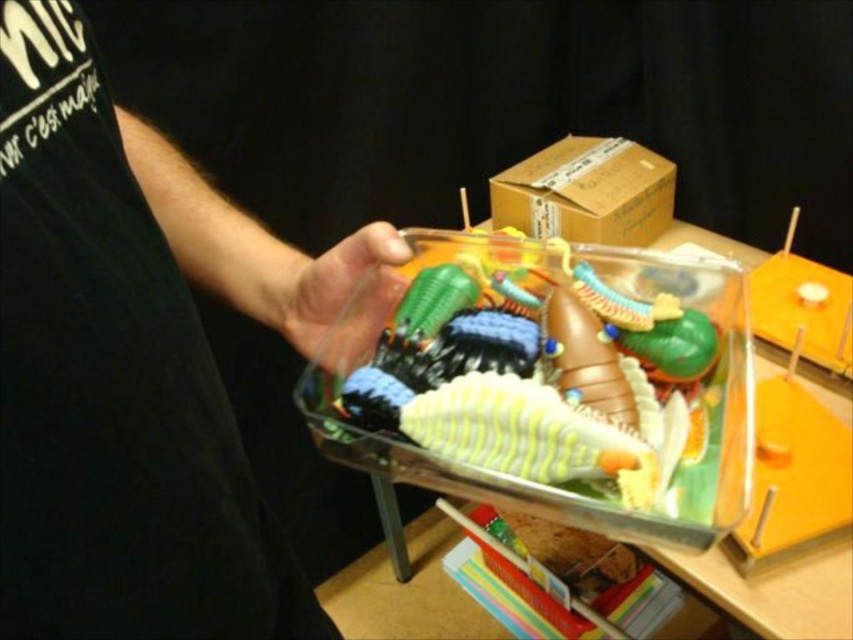
Question: Among these objects, which one is nearest to the camera?

Choices:
 (A) transparent plastic tray at center
 (B) translucent plastic toy at center

Answer: (B)

Question: Is matte plastic toy at upper center closer to camera compared to brown cardboard box at upper center?

Choices:
 (A) no
 (B) yes

Answer: (B)

Question: Which of the following is the closest to the observer?

Choices:
 (A) matte plastic hand at center
 (B) brown cardboard box at upper center
 (C) translucent plastic toy at center
 (D) matte plastic toy at upper center

Answer: (D)

Question: Among these objects, which one is farthest from the camera?

Choices:
 (A) translucent plastic toy at center
 (B) brown cardboard box at upper center
 (C) matte plastic toy at upper center
 (D) matte plastic hand at center

Answer: (B)

Question: Is brown cardboard box at upper center wider than matte plastic hand at center?

Choices:
 (A) no
 (B) yes

Answer: (B)

Question: Does matte plastic toy at upper center appear over brown cardboard box at upper center?

Choices:
 (A) yes
 (B) no

Answer: (B)